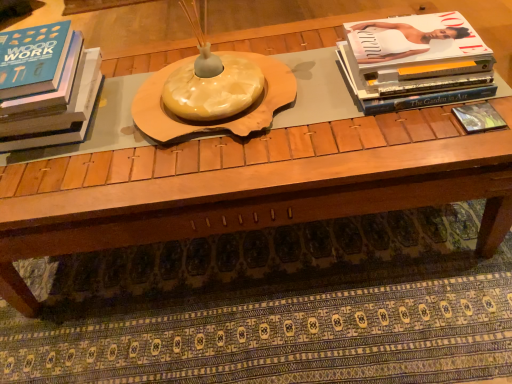
The width and height of the screenshot is (512, 384). I want to click on vacant space situated above matte black book at left, which appears as the third book when viewed from the right (from a real-world perspective), so click(x=30, y=49).